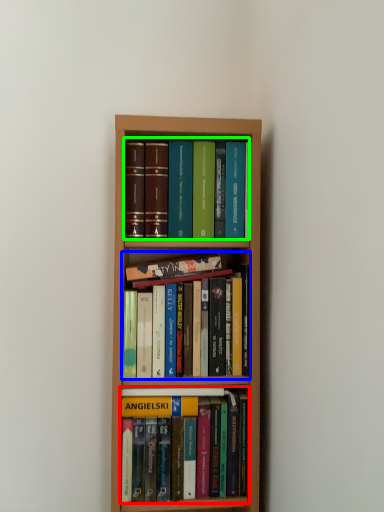
Question: Which is farther away from book (highlighted by a red box)? book (highlighted by a blue box) or book (highlighted by a green box)?

Choices:
 (A) book
 (B) book

Answer: (B)